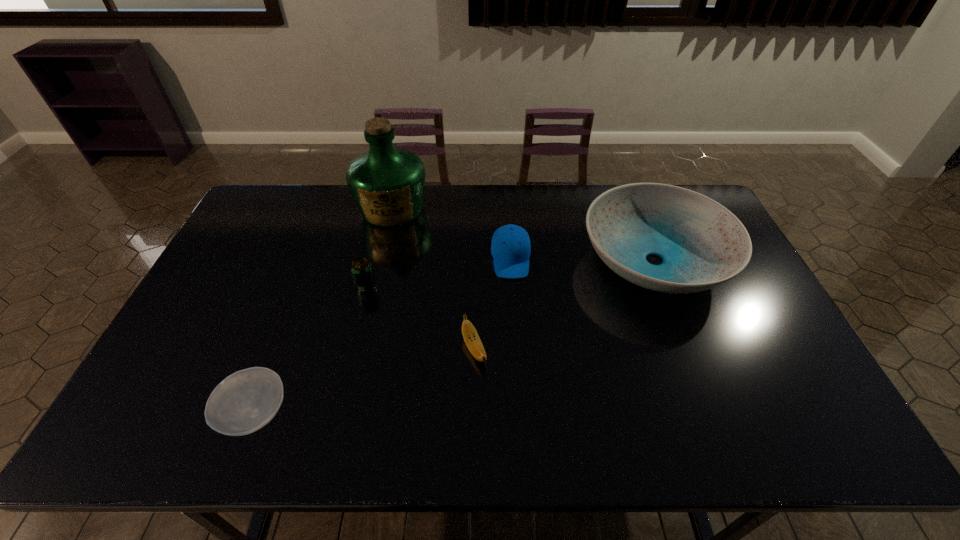
Where is `free space at the near edge of the desktop`? This screenshot has height=540, width=960. free space at the near edge of the desktop is located at coordinates [766, 433].

In the image, there is a desktop. Identify the location of vacant space at the left edge. The height and width of the screenshot is (540, 960). (269, 233).

What are the coordinates of `vacant space at the right edge of the desktop` in the screenshot? It's located at (734, 304).

Find the location of a particular element. free area in between the beer can and the cap is located at coordinates (439, 272).

Locate an element on the screen. Image resolution: width=960 pixels, height=540 pixels. vacant space that's between the second tallest object and the cap is located at coordinates (583, 260).

This screenshot has width=960, height=540. What are the coordinates of `vacant area between the bowl and the second tallest object` in the screenshot? It's located at pyautogui.click(x=455, y=337).

The image size is (960, 540). I want to click on vacant space in between the beer can and the liquor, so click(x=379, y=247).

The image size is (960, 540). Identify the location of free space between the fourth object from left to right and the dish. (564, 305).

The height and width of the screenshot is (540, 960). Find the location of `vacant area between the rightmost object and the bowl`. vacant area between the rightmost object and the bowl is located at coordinates (455, 337).

Locate an element on the screen. This screenshot has width=960, height=540. vacant area that lies between the beer can and the cap is located at coordinates (439, 272).